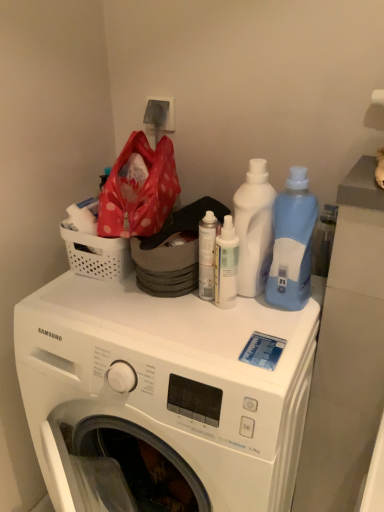
The height and width of the screenshot is (512, 384). What are the coordinates of `vacant area that lies in front of white matte spray can at center` in the screenshot? It's located at tap(212, 341).